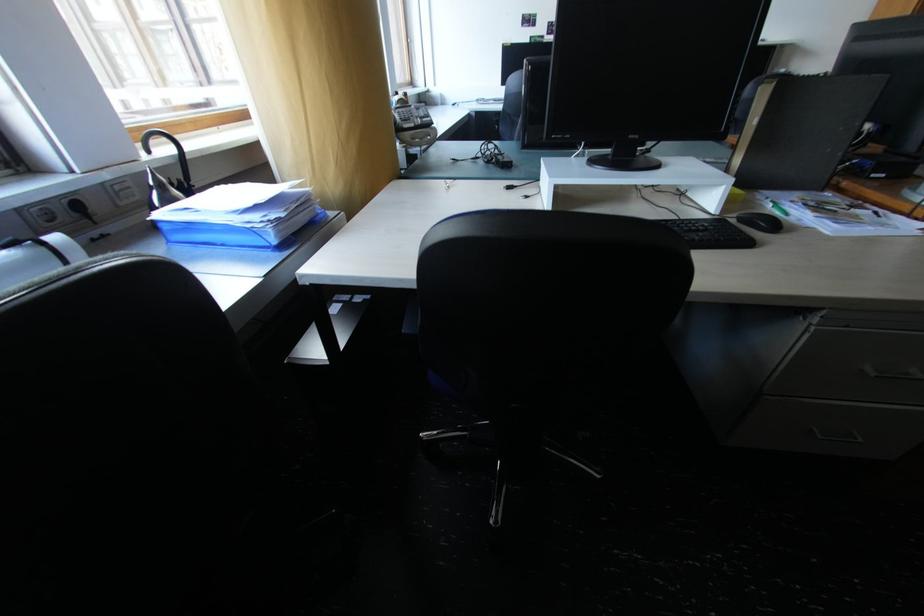
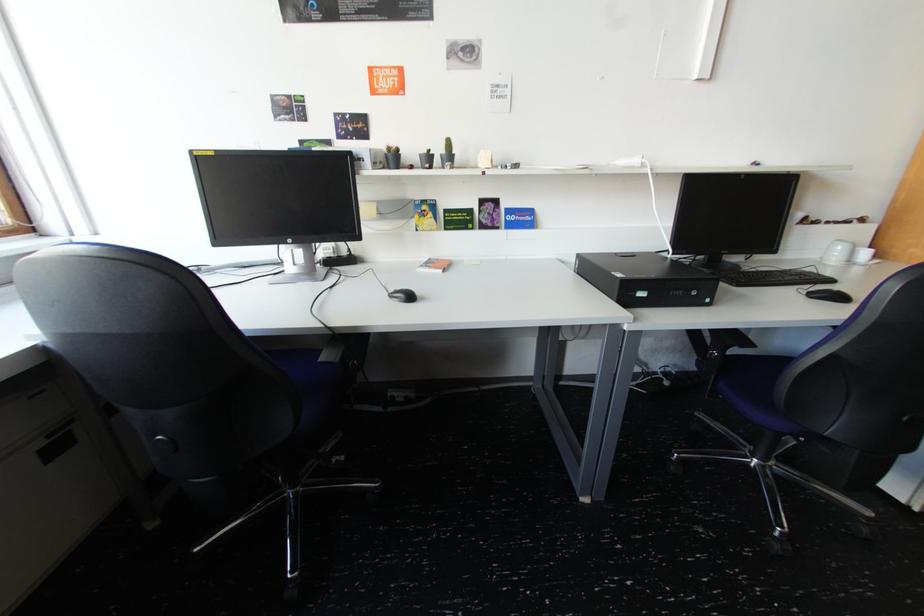
What movement of the cameraman would produce the second image?

The movement direction of the cameraman is right, forward.